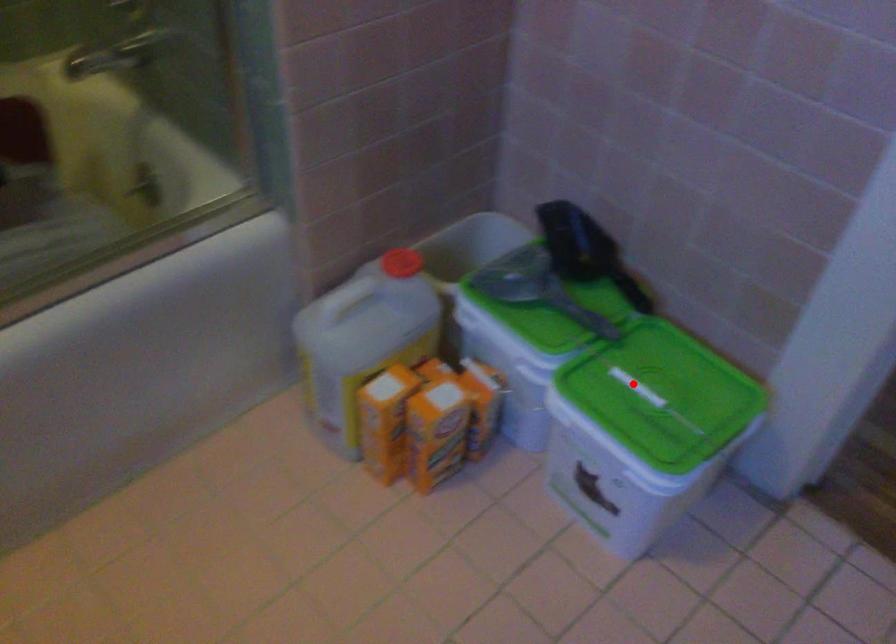
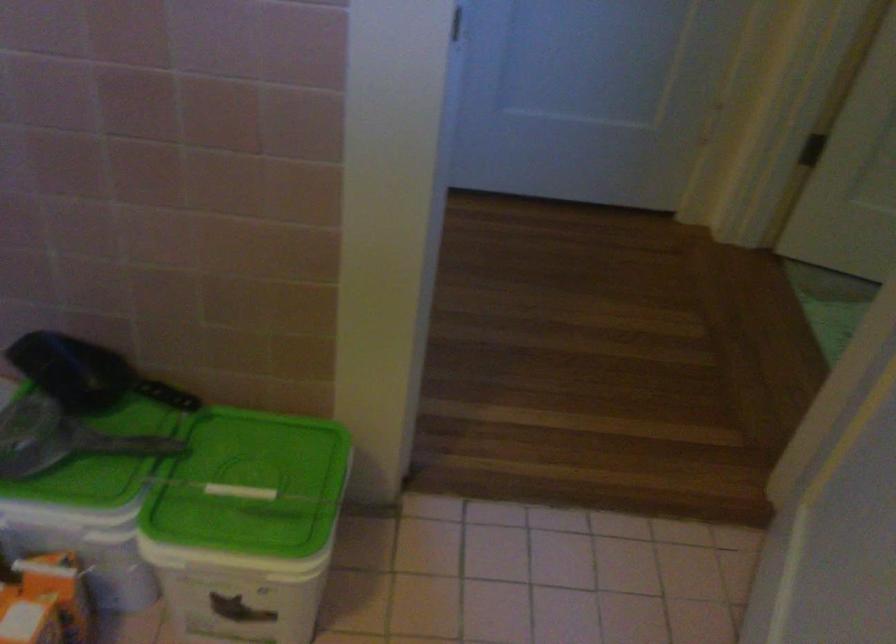
Find the pixel in the second image that matches the highlighted location in the first image.

(239, 491)